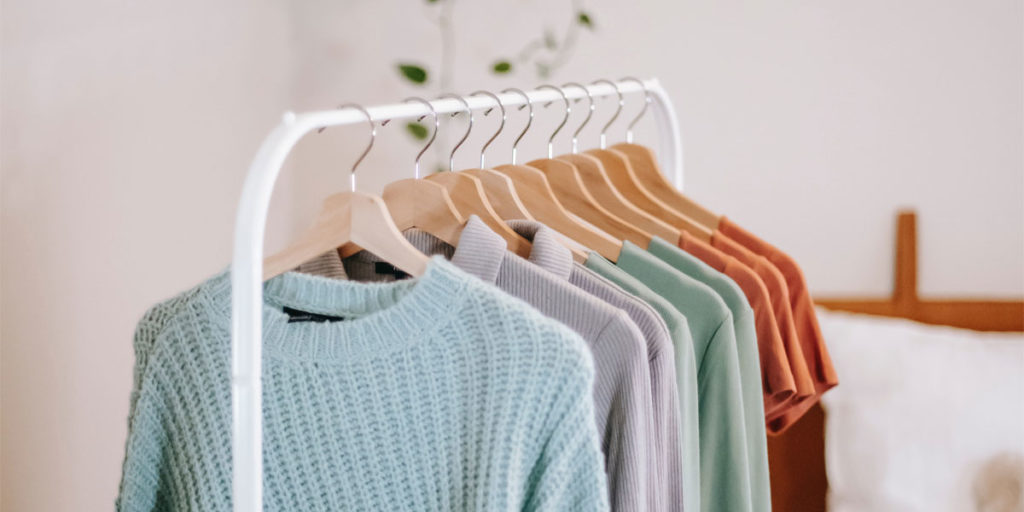
Locate an element on the screen. This screenshot has height=512, width=1024. silver metal hanger hooks is located at coordinates (368, 126), (432, 126), (467, 121), (502, 116), (526, 112), (563, 110), (589, 106), (613, 102), (640, 98).